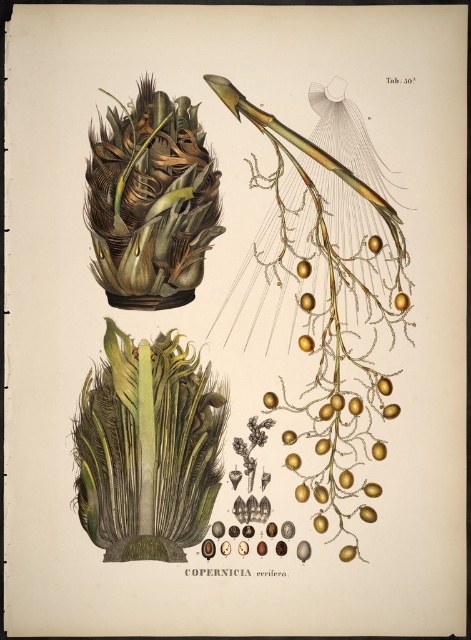
Which is below, brown fibrous plant at upper left or golden glossy fruit at upper right?

golden glossy fruit at upper right

Does brown fibrous plant at upper left have a lesser width compared to golden glossy fruit at upper right?

No.

Who is more forward, (x=116, y=154) or (x=376, y=250)?

Point (x=116, y=154) is more forward.

You are a GUI agent. You are given a task and a screenshot of the screen. Output one action in this format:
    pyautogui.click(x=<x>, y=<y>)
    Task: Click on the brown fibrous plant at upper left
    This screenshot has width=471, height=640.
    Given the screenshot: What is the action you would take?
    pyautogui.click(x=151, y=202)

Is point (400, 310) behind point (373, 244)?

Yes, it is behind point (373, 244).

Can you confirm if golden matte fruit at right is thinner than golden glossy fruit at upper right?

Yes, golden matte fruit at right is thinner than golden glossy fruit at upper right.

Does point (406, 296) come closer to viewer compared to point (375, 252)?

No, (406, 296) is behind (375, 252).

You are a GUI agent. You are given a task and a screenshot of the screen. Output one action in this format:
    pyautogui.click(x=<x>, y=<y>)
    Task: Click on the golden matte fruit at right
    The height and width of the screenshot is (640, 471).
    Given the screenshot: What is the action you would take?
    [402, 301]

Is brown fibrous plant at upper left above golden matte fruit at right?

Yes, brown fibrous plant at upper left is above golden matte fruit at right.

Is point (180, 116) closer to camera compared to point (403, 292)?

Yes, it is in front of point (403, 292).

Which is in front, point (201, 227) or point (398, 300)?

Point (201, 227) is in front.

Find the location of a particular element. The height and width of the screenshot is (640, 471). brown fibrous plant at upper left is located at coordinates (151, 202).